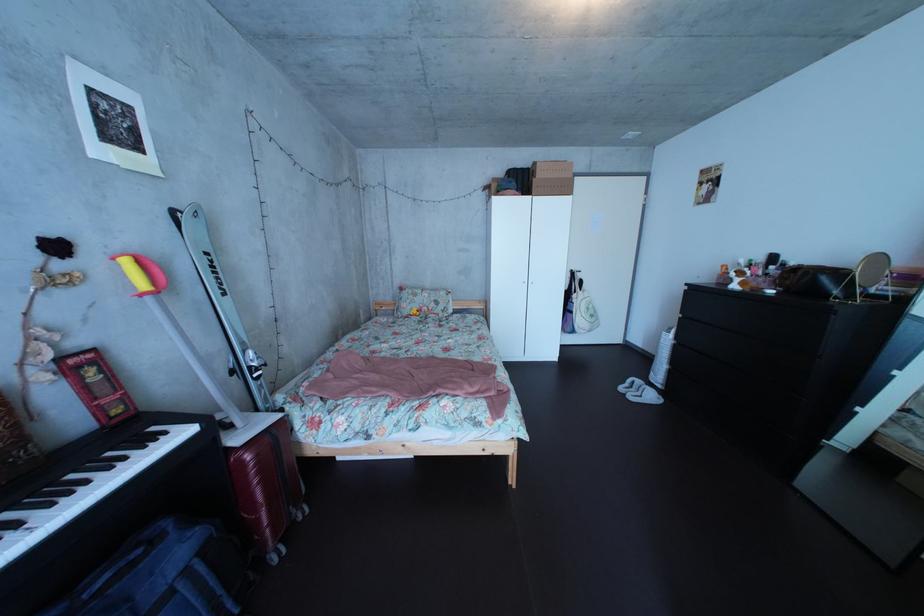
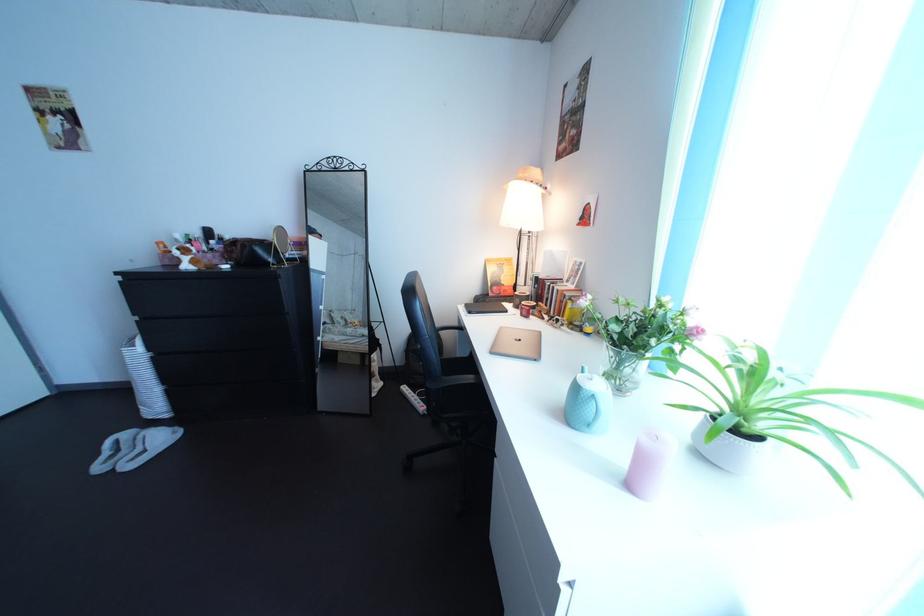
How did the camera likely rotate?

The rotation direction of the camera is right-down.